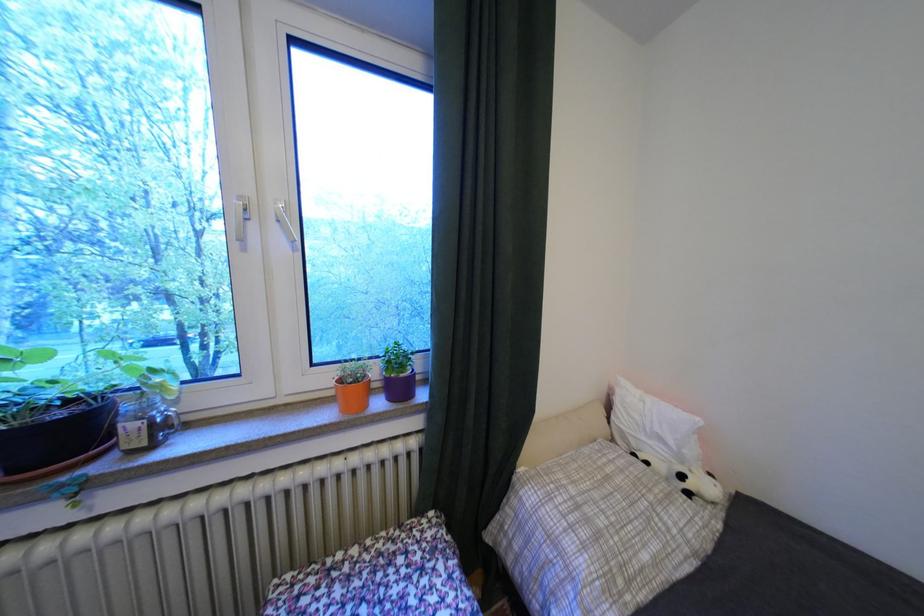
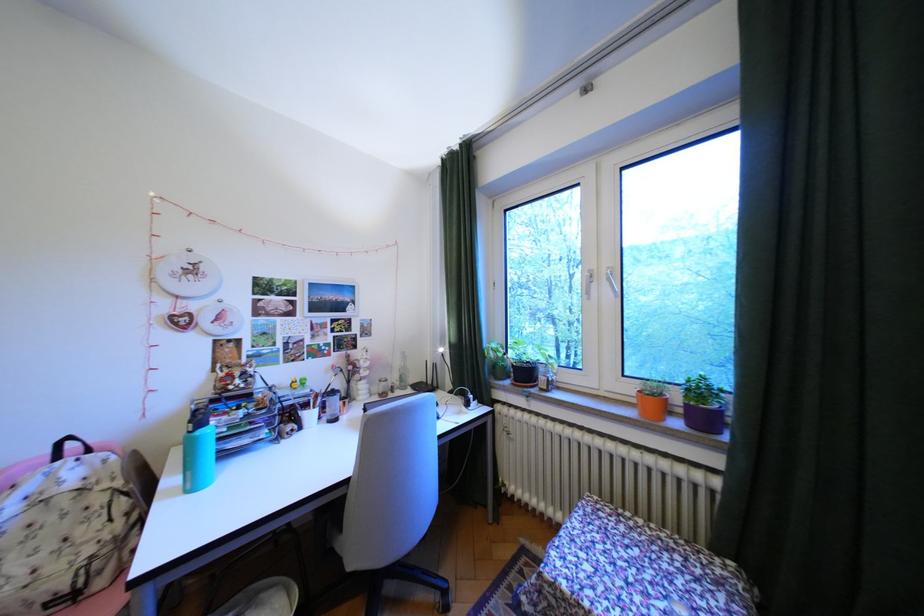
Where in the second image is the point corresponding to [408,361] from the first image?

(710, 391)